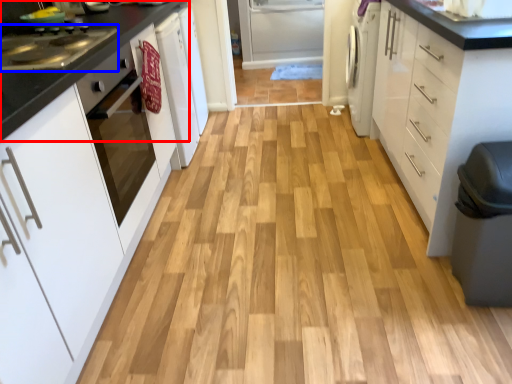
Question: Which point is further to the camera, countertop (highlighted by a red box) or kitchen appliance (highlighted by a blue box)?

Choices:
 (A) countertop
 (B) kitchen appliance

Answer: (A)